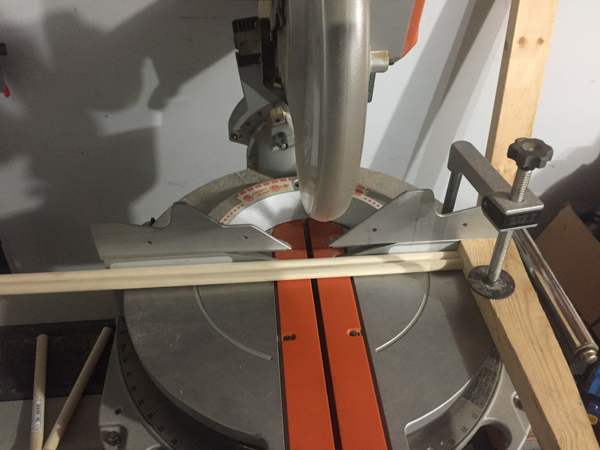
Find the location of a particular element. wall is located at coordinates (100, 67), (585, 98), (565, 130).